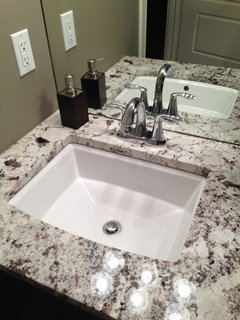
I want to click on faucet, so click(x=130, y=119).